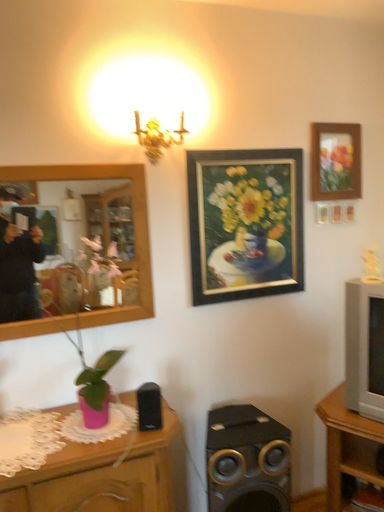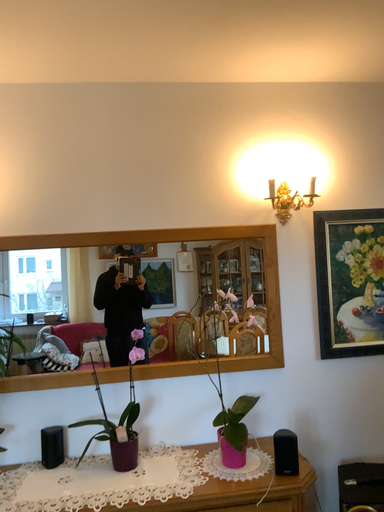
Question: Which way did the camera rotate in the video?

Choices:
 (A) rotated right
 (B) rotated left

Answer: (B)